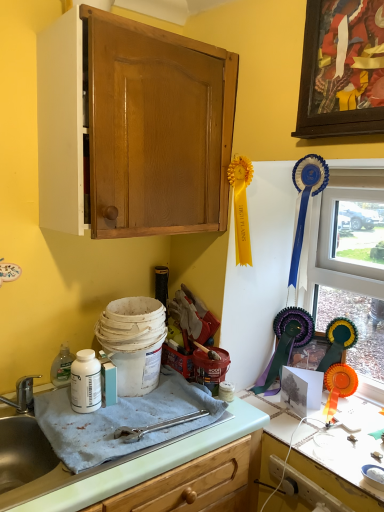
I want to click on blank space situated above white glossy countertop at lower right, which appears as the second countertop when viewed from the left (from a real-world perspective), so click(x=327, y=428).